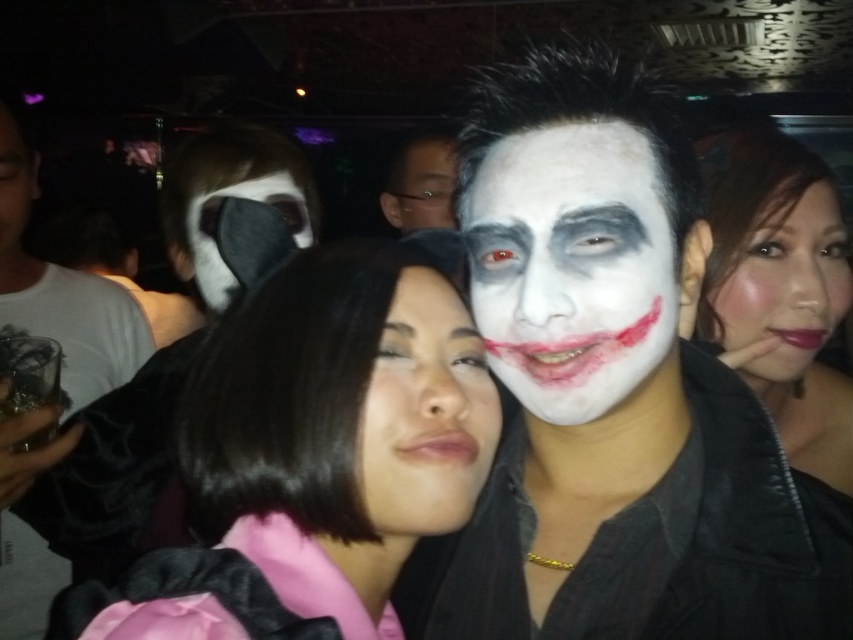
Is pink satin dress at center bigger than white matte face at center?

Incorrect, pink satin dress at center is not larger than white matte face at center.

Consider the image. Does pink satin dress at center come in front of white matte face at center?

Yes, pink satin dress at center is in front of white matte face at center.

Locate an element on the screen. The height and width of the screenshot is (640, 853). pink satin dress at center is located at coordinates (341, 422).

This screenshot has height=640, width=853. What are the coordinates of `pink satin dress at center` in the screenshot? It's located at (341, 422).

In the scene shown: Is matte black jacket at right closer to the viewer compared to white matte face at center?

Yes, it is in front of white matte face at center.

Based on the photo, does matte black jacket at right appear under white matte face at center?

Yes, matte black jacket at right is below white matte face at center.

Does point (842, 243) come in front of point (439, 211)?

That is True.

Where is `matte black jacket at right`? This screenshot has width=853, height=640. matte black jacket at right is located at coordinates (780, 285).

Which is in front, point (401, 307) or point (827, 397)?

Point (401, 307)

Does pink satin dress at center have a lesser height compared to matte black jacket at right?

Yes.

Between point (366, 534) and point (735, 264), which one is positioned in front?

Point (366, 534) is more forward.

Identify the location of pink satin dress at center. This screenshot has height=640, width=853. (341, 422).